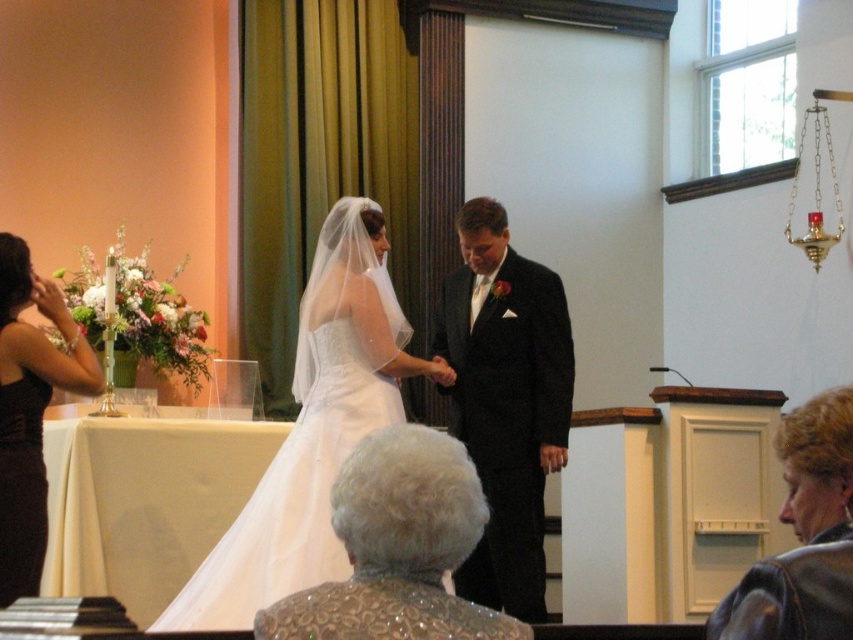
You are a photographer at the wedding ceremony. You need to capture a closeup shot of the white satin dress at center and the black satin suit at center. Which one should you focus on first if you want to ensure both are in focus?

The white satin dress at center is bigger than the black satin suit at center, so you should focus on the white satin dress at center first to ensure both are in focus.

You are a photographer at a wedding ceremony. You need to capture a photo of the black satin suit at center and the black satin dress at left. Based on their heights, which one should you focus on first to ensure both are in frame?

The black satin suit at center is taller than the black satin dress at left, so you should focus on the black satin suit at center first to ensure both are in frame.